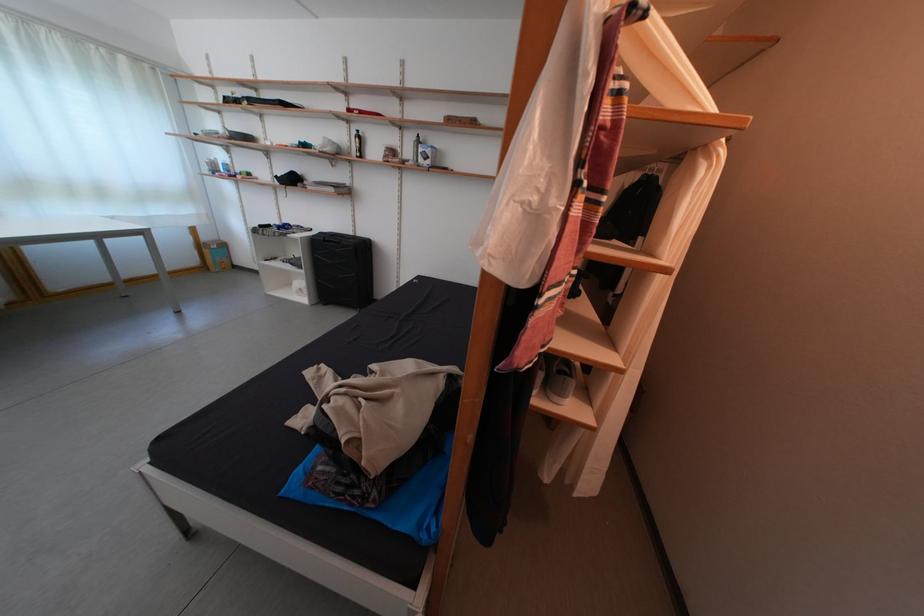
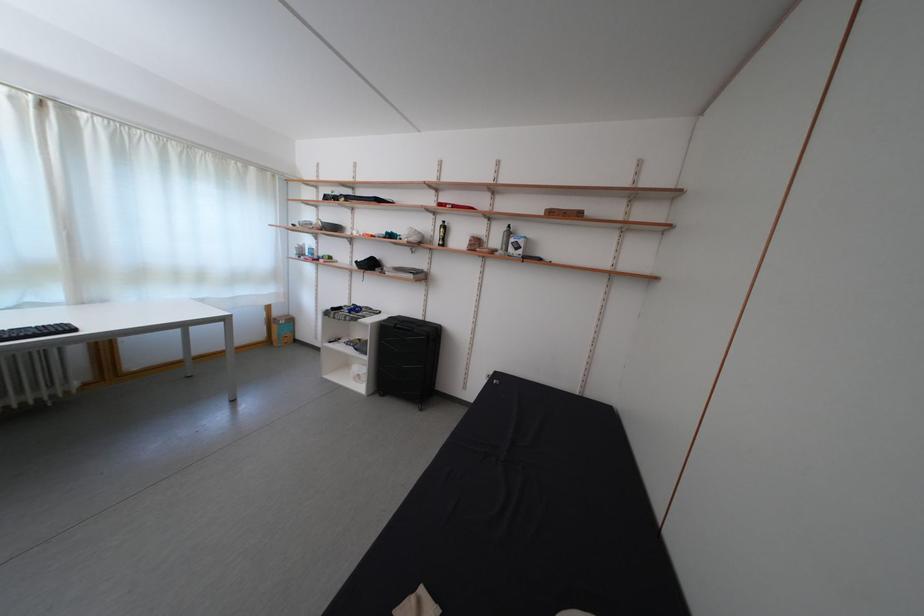
In the second image, find the point that corresponds to point (223, 129) in the first image.

(319, 221)